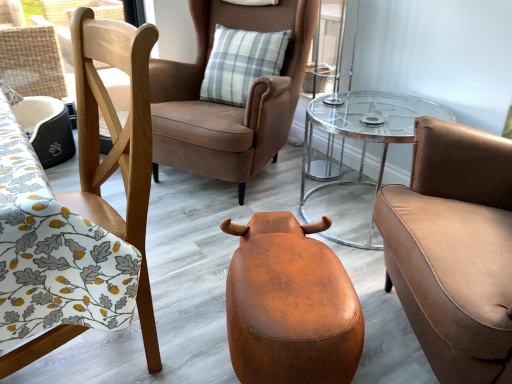
Image resolution: width=512 pixels, height=384 pixels. What are the coordinates of `matte brown leather armchair at right, marked as the first chair in a right-to-left arrangement` in the screenshot? It's located at (454, 250).

I want to click on brown leather chair at center, positioned as the second chair in left-to-right order, so click(229, 105).

Identify the location of matte brown leather armchair at right, marked as the first chair in a right-to-left arrangement. Image resolution: width=512 pixels, height=384 pixels. (454, 250).

From the image's perspective, which object appears higher, leather ottoman at center or matte brown leather armchair at right, positioned as the 3th chair in left-to-right order?

matte brown leather armchair at right, positioned as the 3th chair in left-to-right order, is shown above in the image.

Considering the relative sizes of leather ottoman at center and matte brown leather armchair at right, marked as the first chair in a right-to-left arrangement, in the image provided, is leather ottoman at center shorter than matte brown leather armchair at right, marked as the first chair in a right-to-left arrangement,?

Correct, leather ottoman at center is not as tall as matte brown leather armchair at right, marked as the first chair in a right-to-left arrangement.

Considering the sizes of objects leather ottoman at center and matte brown leather armchair at right, marked as the first chair in a right-to-left arrangement, in the image provided, who is thinner, leather ottoman at center or matte brown leather armchair at right, marked as the first chair in a right-to-left arrangement,?

With smaller width is leather ottoman at center.

Considering the sizes of leather ottoman at center and matte brown leather armchair at right, marked as the first chair in a right-to-left arrangement, in the image, is leather ottoman at center bigger or smaller than matte brown leather armchair at right, marked as the first chair in a right-to-left arrangement,?

Considering their sizes, leather ottoman at center takes up less space than matte brown leather armchair at right, marked as the first chair in a right-to-left arrangement.

From the image's perspective, is brown leather chair at center, marked as the 2th chair in a right-to-left arrangement, located above clear glass table at center?

Yes, from the image's perspective, brown leather chair at center, marked as the 2th chair in a right-to-left arrangement, is above clear glass table at center.

Is brown leather chair at center, positioned as the second chair in left-to-right order, at the left side of clear glass table at center?

Yes.

Is brown leather chair at center, positioned as the second chair in left-to-right order, with clear glass table at center?

No, brown leather chair at center, positioned as the second chair in left-to-right order, is not beside clear glass table at center.

Which is behind, point (291, 80) or point (306, 155)?

Positioned behind is point (291, 80).

From the image's perspective, is clear glass table at center above or below wooden chair at left, acting as the first chair starting from the left?

Based on their image positions, clear glass table at center is located above wooden chair at left, acting as the first chair starting from the left.

Considering the positions of objects clear glass table at center and wooden chair at left, acting as the first chair starting from the left, in the image provided, who is more to the right, clear glass table at center or wooden chair at left, acting as the first chair starting from the left,?

clear glass table at center is more to the right.

In terms of size, does clear glass table at center appear bigger or smaller than wooden chair at left, which appears as the third chair when viewed from the right?

Considering their sizes, clear glass table at center takes up less space than wooden chair at left, which appears as the third chair when viewed from the right.

Locate an element on the screen. The width and height of the screenshot is (512, 384). table behind the wooden chair at left, which appears as the third chair when viewed from the right is located at coordinates (365, 126).

Can you confirm if wooden chair at left, which appears as the third chair when viewed from the right, is wider than brown leather chair at center, marked as the 2th chair in a right-to-left arrangement?

No.

Are wooden chair at left, which appears as the third chair when viewed from the right, and brown leather chair at center, positioned as the second chair in left-to-right order, far apart?

That's not correct — wooden chair at left, which appears as the third chair when viewed from the right, is a little close to brown leather chair at center, positioned as the second chair in left-to-right order.

Can we say wooden chair at left, acting as the first chair starting from the left, lies outside brown leather chair at center, positioned as the second chair in left-to-right order?

Indeed, wooden chair at left, acting as the first chair starting from the left, is completely outside brown leather chair at center, positioned as the second chair in left-to-right order.

Where is `chair behind the wooden chair at left, which appears as the third chair when viewed from the right`? The width and height of the screenshot is (512, 384). chair behind the wooden chair at left, which appears as the third chair when viewed from the right is located at coordinates (229, 105).

Do you think clear glass table at center is within brown leather chair at center, marked as the 2th chair in a right-to-left arrangement, or outside of it?

clear glass table at center lies outside brown leather chair at center, marked as the 2th chair in a right-to-left arrangement.

How much distance is there between clear glass table at center and brown leather chair at center, positioned as the second chair in left-to-right order?

clear glass table at center and brown leather chair at center, positioned as the second chair in left-to-right order, are 45.53 centimeters apart from each other.

Is clear glass table at center not close to brown leather chair at center, marked as the 2th chair in a right-to-left arrangement?

No, clear glass table at center is in close proximity to brown leather chair at center, marked as the 2th chair in a right-to-left arrangement.

Is clear glass table at center taller or shorter than brown leather chair at center, marked as the 2th chair in a right-to-left arrangement?

Considering their sizes, clear glass table at center has less height than brown leather chair at center, marked as the 2th chair in a right-to-left arrangement.

From a real-world perspective, which is physically below, matte brown leather armchair at right, positioned as the 3th chair in left-to-right order, or wooden chair at left, which appears as the third chair when viewed from the right?

wooden chair at left, which appears as the third chair when viewed from the right, is physically lower.

Is matte brown leather armchair at right, marked as the first chair in a right-to-left arrangement, far from wooden chair at left, acting as the first chair starting from the left?

Actually, matte brown leather armchair at right, marked as the first chair in a right-to-left arrangement, and wooden chair at left, acting as the first chair starting from the left, are a little close together.

Between matte brown leather armchair at right, positioned as the 3th chair in left-to-right order, and wooden chair at left, which appears as the third chair when viewed from the right, which one has more height?

With more height is matte brown leather armchair at right, positioned as the 3th chair in left-to-right order.

Could wooden chair at left, which appears as the third chair when viewed from the right, be considered to be inside matte brown leather armchair at right, positioned as the 3th chair in left-to-right order?

That's incorrect, wooden chair at left, which appears as the third chair when viewed from the right, is not inside matte brown leather armchair at right, positioned as the 3th chair in left-to-right order.

Where is `swivel chair below the clear glass table at center (from a real-world perspective)`? The height and width of the screenshot is (384, 512). swivel chair below the clear glass table at center (from a real-world perspective) is located at coordinates (290, 304).

Is leather ottoman at center wider than clear glass table at center?

Yes.

Can you confirm if leather ottoman at center is positioned to the right of clear glass table at center?

No.

Where is `chair lying on the right of leather ottoman at center`? Image resolution: width=512 pixels, height=384 pixels. chair lying on the right of leather ottoman at center is located at coordinates (454, 250).

From a real-world perspective, count 1st chairs upward from the clear glass table at center and point to it. Please provide its 2D coordinates.

[(229, 105)]

Estimate the real-world distances between objects in this image. Which object is closer to matte brown leather armchair at right, positioned as the 3th chair in left-to-right order, brown leather chair at center, positioned as the second chair in left-to-right order, or wooden chair at left, which appears as the third chair when viewed from the right?

wooden chair at left, which appears as the third chair when viewed from the right, lies closer to matte brown leather armchair at right, positioned as the 3th chair in left-to-right order, than the other object.

Which object lies further to the anchor point brown leather chair at center, marked as the 2th chair in a right-to-left arrangement, leather ottoman at center or wooden chair at left, which appears as the third chair when viewed from the right?

leather ottoman at center.

Based on their spatial positions, is clear glass table at center or wooden chair at left, acting as the first chair starting from the left, closer to matte brown leather armchair at right, positioned as the 3th chair in left-to-right order?

clear glass table at center is closer to matte brown leather armchair at right, positioned as the 3th chair in left-to-right order.

Looking at the image, which one is located further to brown leather chair at center, positioned as the second chair in left-to-right order, wooden chair at left, acting as the first chair starting from the left, or clear glass table at center?

Based on the image, wooden chair at left, acting as the first chair starting from the left, appears to be further to brown leather chair at center, positioned as the second chair in left-to-right order.

Looking at the image, which one is located closer to brown leather chair at center, positioned as the second chair in left-to-right order, matte brown leather armchair at right, marked as the first chair in a right-to-left arrangement, or clear glass table at center?

clear glass table at center lies closer to brown leather chair at center, positioned as the second chair in left-to-right order, than the other object.

Estimate the real-world distances between objects in this image. Which object is closer to matte brown leather armchair at right, positioned as the 3th chair in left-to-right order, brown leather chair at center, marked as the 2th chair in a right-to-left arrangement, or clear glass table at center?

Based on the image, clear glass table at center appears to be nearer to matte brown leather armchair at right, positioned as the 3th chair in left-to-right order.

Estimate the real-world distances between objects in this image. Which object is closer to leather ottoman at center, brown leather chair at center, positioned as the second chair in left-to-right order, or clear glass table at center?

Based on the image, clear glass table at center appears to be nearer to leather ottoman at center.

Based on their spatial positions, is wooden chair at left, acting as the first chair starting from the left, or matte brown leather armchair at right, positioned as the 3th chair in left-to-right order, closer to brown leather chair at center, marked as the 2th chair in a right-to-left arrangement?

wooden chair at left, acting as the first chair starting from the left, lies closer to brown leather chair at center, marked as the 2th chair in a right-to-left arrangement, than the other object.

Identify the location of chair between wooden chair at left, which appears as the third chair when viewed from the right, and matte brown leather armchair at right, marked as the first chair in a right-to-left arrangement, from left to right. (229, 105).

Image resolution: width=512 pixels, height=384 pixels. I want to click on swivel chair between matte brown leather armchair at right, positioned as the 3th chair in left-to-right order, and brown leather chair at center, positioned as the second chair in left-to-right order, in the front-back direction, so click(290, 304).

The image size is (512, 384). Identify the location of table between matte brown leather armchair at right, positioned as the 3th chair in left-to-right order, and brown leather chair at center, positioned as the second chair in left-to-right order, in the front-back direction. (365, 126).

In order to click on swivel chair between wooden chair at left, acting as the first chair starting from the left, and matte brown leather armchair at right, marked as the first chair in a right-to-left arrangement, from left to right in this screenshot , I will do `click(290, 304)`.